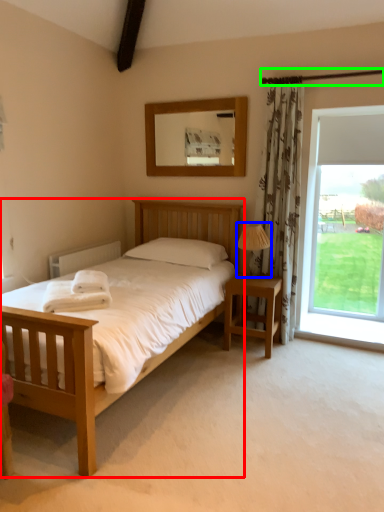
Question: Which object is the farthest from bed (highlighted by a red box)? Choose among these: lamp (highlighted by a blue box) or balcony (highlighted by a green box).

Choices:
 (A) lamp
 (B) balcony

Answer: (B)